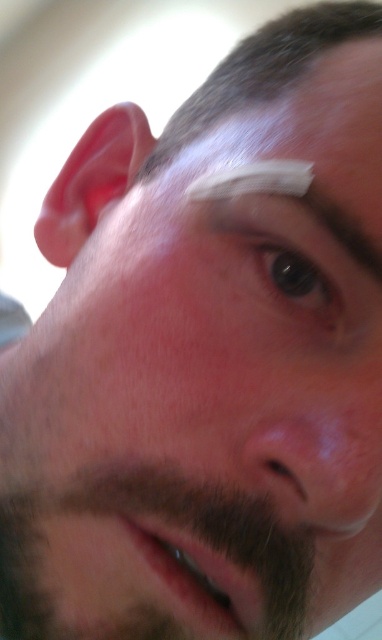
Question: Which point is farther from the camera taking this photo?

Choices:
 (A) (270, 97)
 (B) (297, 609)

Answer: (A)

Question: Does dark brown fuzzy beard at lower left have a smaller size compared to dark brown hair at upper center?

Choices:
 (A) no
 (B) yes

Answer: (B)

Question: Can you confirm if smooth skin nose at center is smaller than black glossy eye at center?

Choices:
 (A) yes
 (B) no

Answer: (B)

Question: Which point appears farthest from the camera in this image?

Choices:
 (A) (249, 189)
 (B) (286, 248)
 (C) (171, 118)
 (D) (294, 220)

Answer: (C)

Question: Which point is farther to the camera?

Choices:
 (A) (328, 500)
 (B) (280, 173)
 (C) (307, 292)
 (D) (302, 220)

Answer: (C)

Question: Does brown matte eye at center appear under white matte bandage at upper center?

Choices:
 (A) yes
 (B) no

Answer: (A)